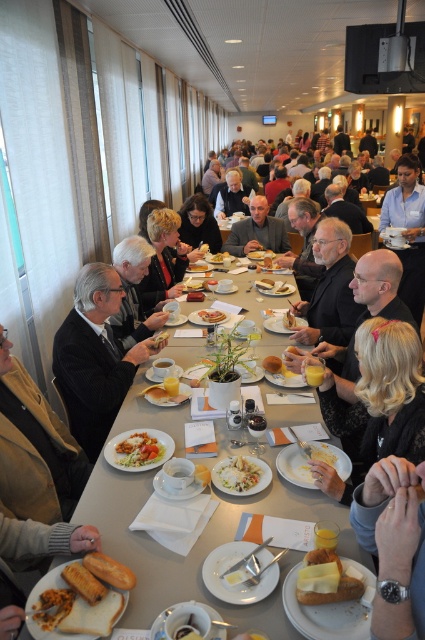
Which of these two, smooth gray suit at center or matte white plate at center, stands taller?

smooth gray suit at center is taller.

Which is behind, point (266, 202) or point (210, 260)?

Positioned behind is point (266, 202).

What are the coordinates of `smooth gray suit at center` in the screenshot? It's located at 257,230.

Can you confirm if blue shirt at upper right is positioned to the right of smooth yellow bread at center?

Correct, you'll find blue shirt at upper right to the right of smooth yellow bread at center.

Is point (402, 234) closer to camera compared to point (274, 362)?

No.

Who is more distant from viewer, (408, 177) or (275, 364)?

The point (408, 177) is behind.

I want to click on blue shirt at upper right, so click(408, 230).

Who is higher up, smooth gray suit at center or white creamy pasta at center?

Positioned higher is smooth gray suit at center.

Measure the distance between point (263, 218) and camera.

16.11 feet

At what (x,y) coordinates should I click in order to perform the action: click on smooth gray suit at center. Please return your answer as a coordinate pair (x, y). The height and width of the screenshot is (640, 425). Looking at the image, I should click on (257, 230).